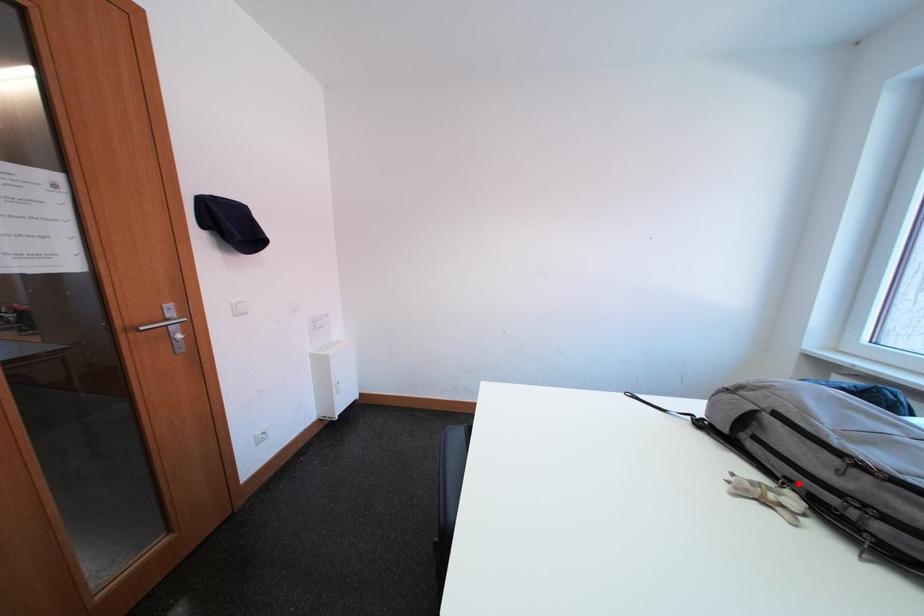
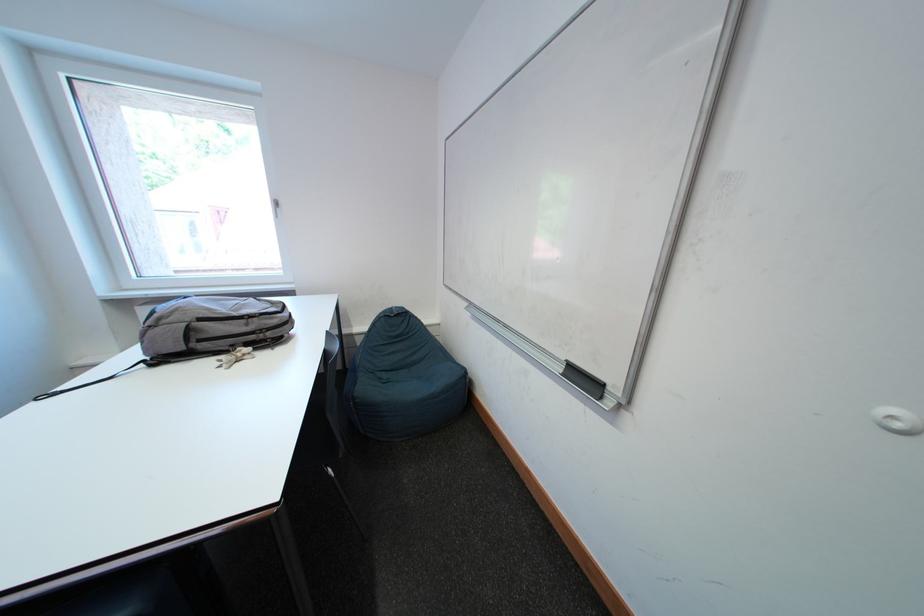
Find the pixel in the second image that matches the highlighted location in the first image.

(241, 349)